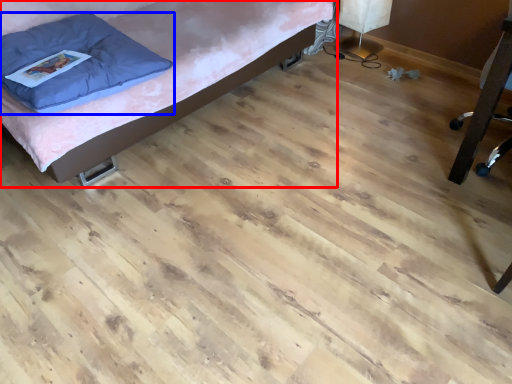
Question: Which point is further to the camera, furniture (highlighted by a red box) or pillow (highlighted by a blue box)?

Choices:
 (A) furniture
 (B) pillow

Answer: (B)